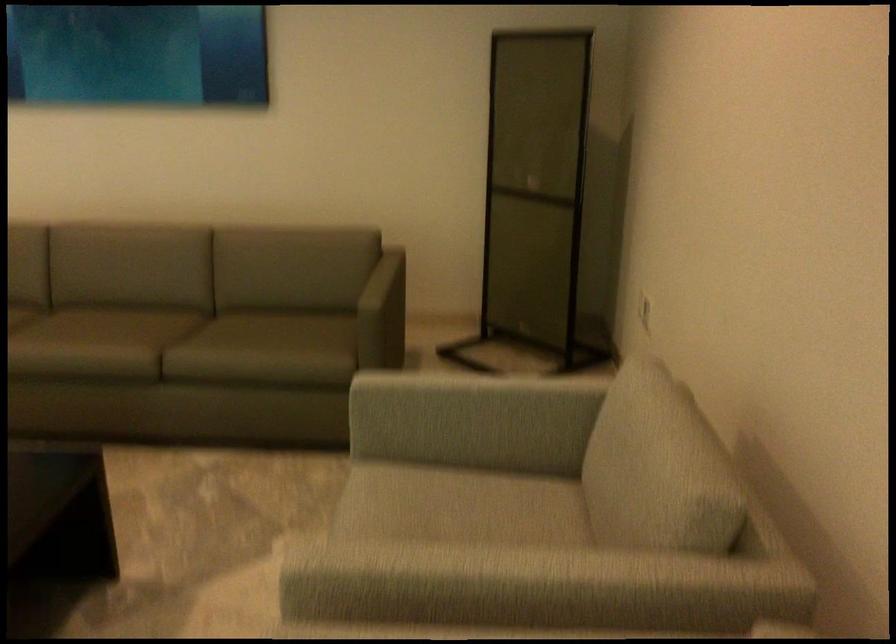
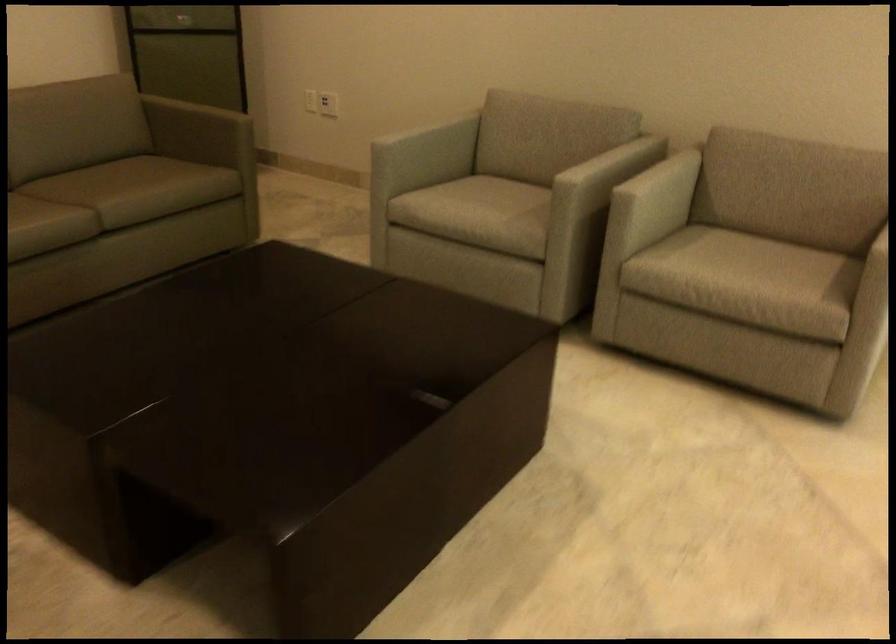
The point at (609, 545) is marked in the first image. Where is the corresponding point in the second image?

(588, 149)